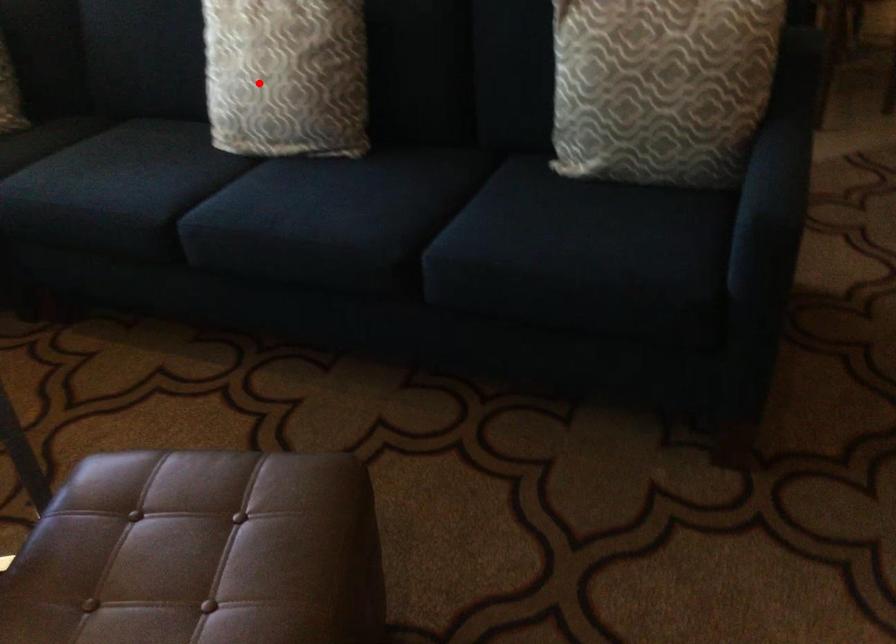
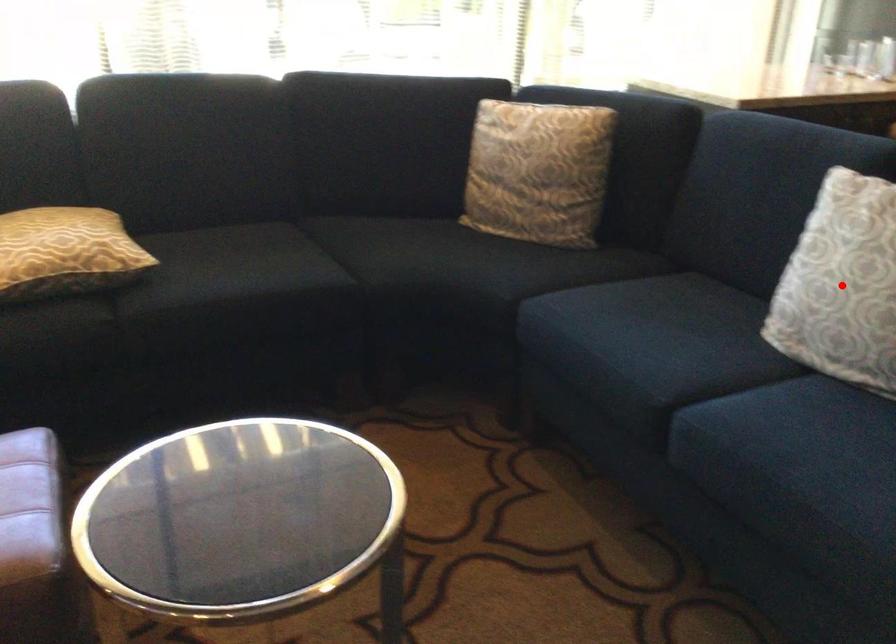
I am providing you with two images of the same scene from different viewpoints. A red point is marked on the first image and another point is marked on the second image. Does the point marked in image1 correspond to the same location as the one in image2?

Yes